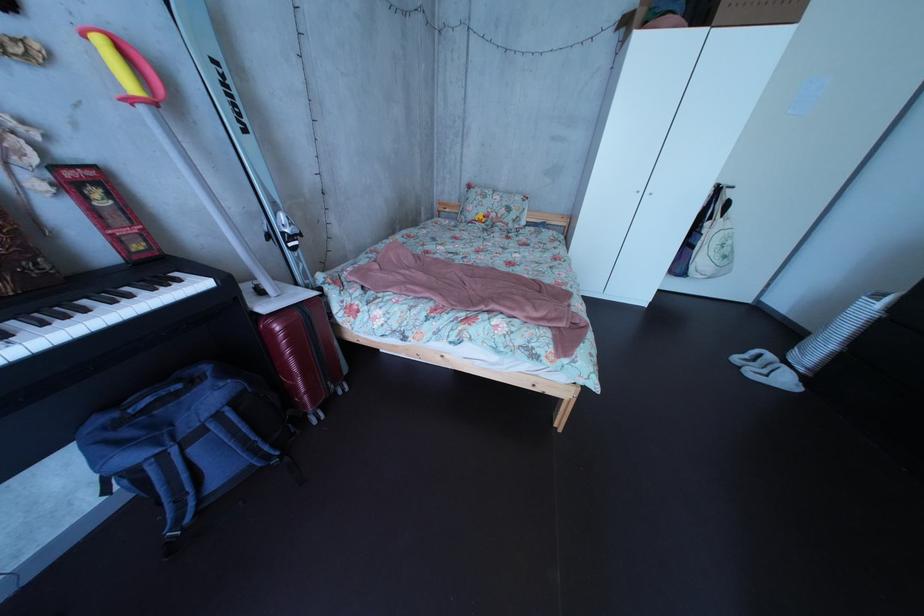
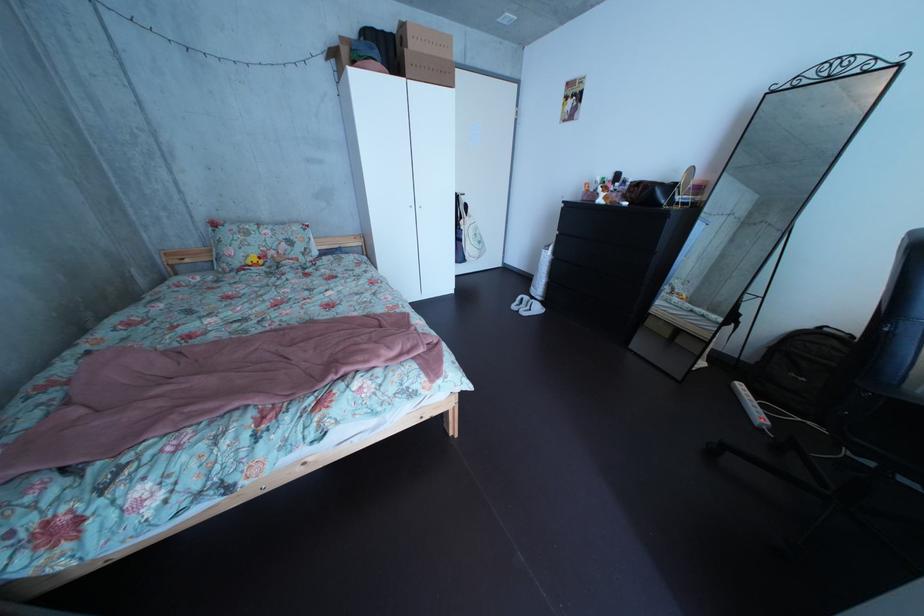
Question: The camera is either moving clockwise (left) or counter-clockwise (right) around the object. The first image is from the beginning of the video and the second image is from the end. Is the camera moving left or right when shooting the video?

Choices:
 (A) Left
 (B) Right

Answer: (A)